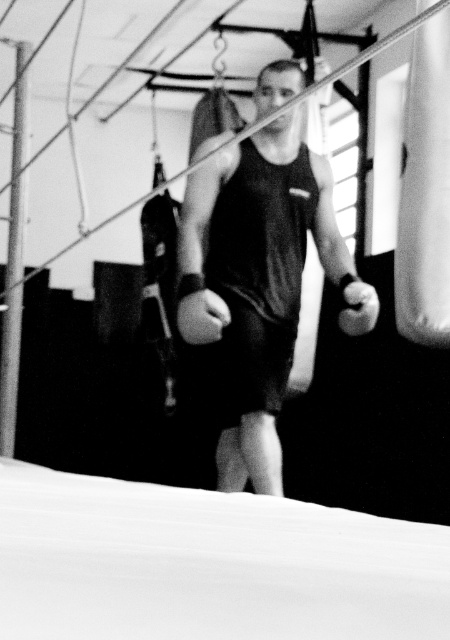
Question: Which point appears closest to the camera in this image?

Choices:
 (A) (360, 305)
 (B) (256, 321)

Answer: (B)

Question: Where is black matte tank top at center located in relation to black matte boxing glove at center in the image?

Choices:
 (A) below
 (B) above

Answer: (B)

Question: Is the position of black matte tank top at center less distant than that of black matte boxing glove at center?

Choices:
 (A) yes
 (B) no

Answer: (A)

Question: Which point is closer to the camera?

Choices:
 (A) black matte tank top at center
 (B) black matte boxing glove at center

Answer: (A)

Question: Can you confirm if black matte tank top at center is positioned below black matte boxing glove at center?

Choices:
 (A) no
 (B) yes

Answer: (A)